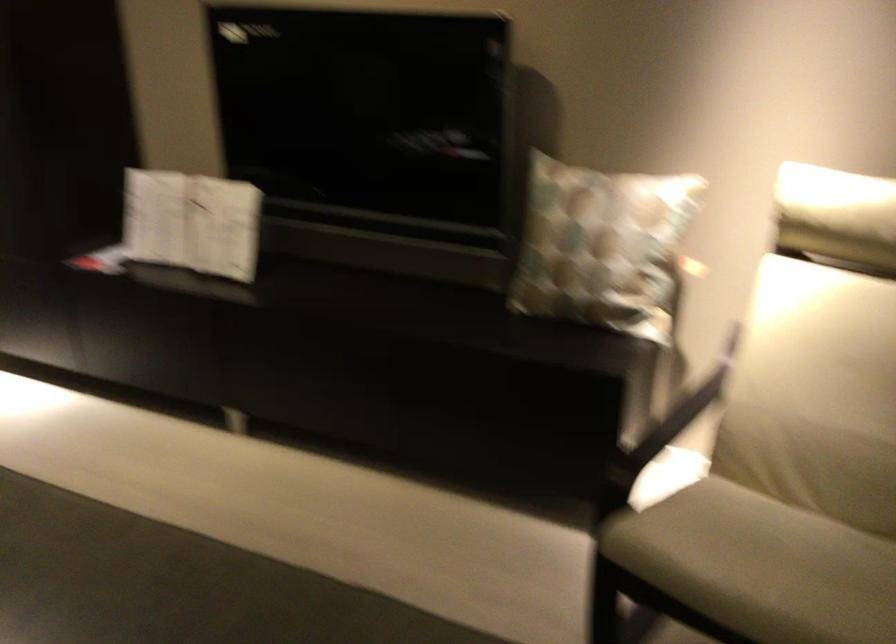
At what (x,y) coordinates should I click in order to perform the action: click on dark chair armrest. Please return your answer as a coordinate pair (x, y). The width and height of the screenshot is (896, 644). Looking at the image, I should click on (652, 446).